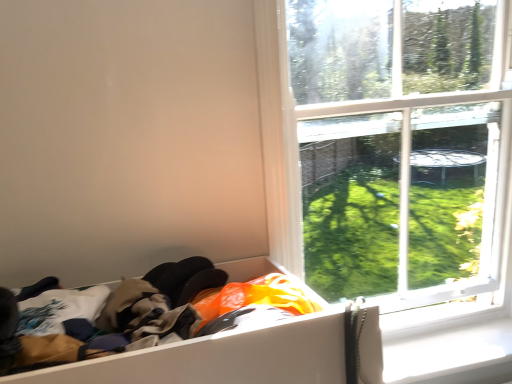
Question: From a real-world perspective, relative to transparent glass window at upper right, is white cardboard box at lower left vertically above or below?

Choices:
 (A) above
 (B) below

Answer: (B)

Question: Considering the relative positions of white cardboard box at lower left and transparent glass window at upper right in the image provided, is white cardboard box at lower left to the left or to the right of transparent glass window at upper right?

Choices:
 (A) right
 (B) left

Answer: (B)

Question: Estimate the real-world distances between objects in this image. Which object is farther from the white cardboard box at lower left?

Choices:
 (A) transparent glass window at upper right
 (B) white plastic window sill at lower right

Answer: (B)

Question: Which of these objects is positioned closest to the white cardboard box at lower left?

Choices:
 (A) white plastic window sill at lower right
 (B) transparent glass window at upper right

Answer: (B)